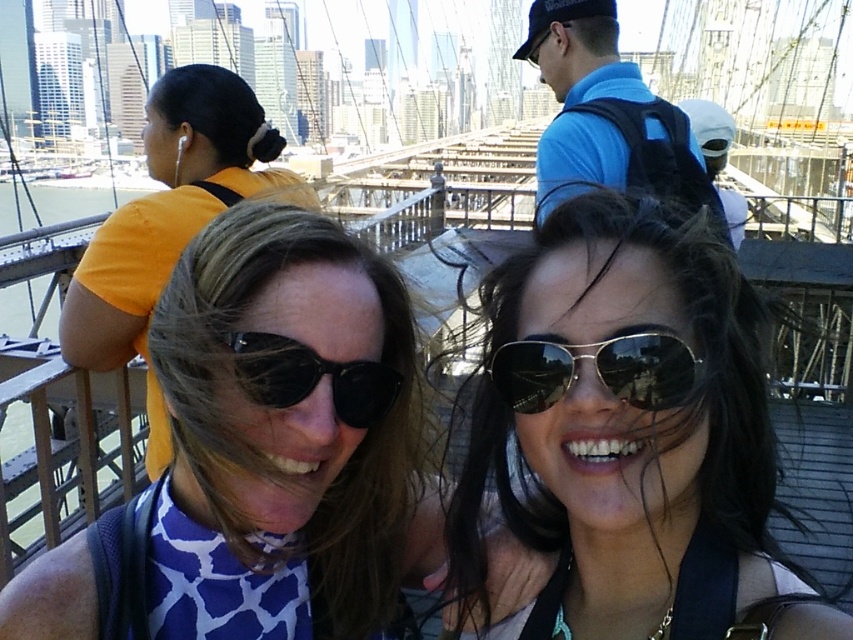
Question: Which of the following is the closest to the observer?

Choices:
 (A) (543, 172)
 (B) (534, 378)
 (C) (538, 412)

Answer: (B)

Question: Can you confirm if blue printed shirt at center is bigger than metallic reflective sunglasses at center?

Choices:
 (A) no
 (B) yes

Answer: (B)

Question: Estimate the real-world distances between objects in this image. Which object is closer to the shiny black sunglasses at center?

Choices:
 (A) black reflective sunglasses at center
 (B) metallic reflective sunglasses at center
 (C) blue fabric backpack at upper center
 (D) blue printed shirt at center

Answer: (B)

Question: Is blue printed shirt at center wider than matte black sunglasses at center?

Choices:
 (A) no
 (B) yes

Answer: (B)

Question: Which point appears farthest from the camera in this image?

Choices:
 (A) (164, 176)
 (B) (633, 342)
 (C) (381, 364)

Answer: (A)

Question: Observing the image, what is the correct spatial positioning of blue fabric backpack at upper center in reference to metallic reflective sunglasses at center?

Choices:
 (A) below
 (B) above

Answer: (B)